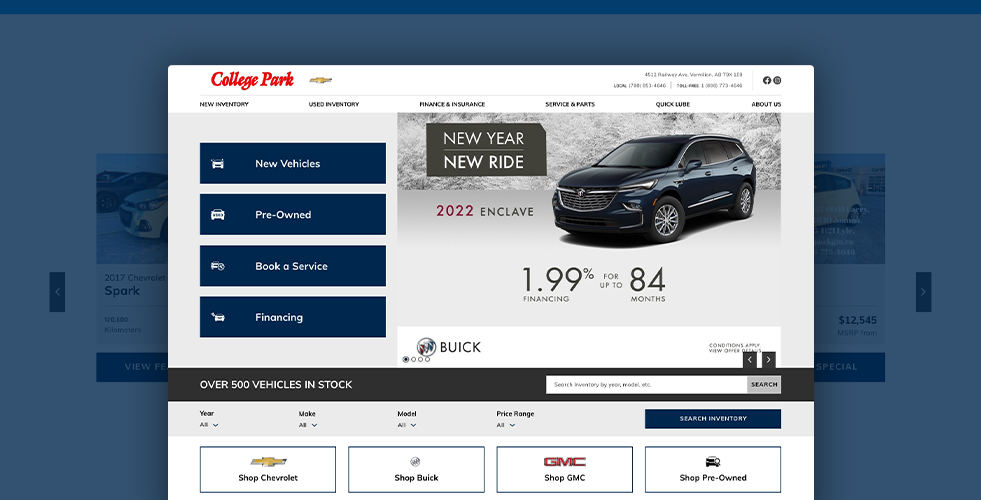
Where is `door handle`? The height and width of the screenshot is (500, 981). door handle is located at coordinates (736, 169).